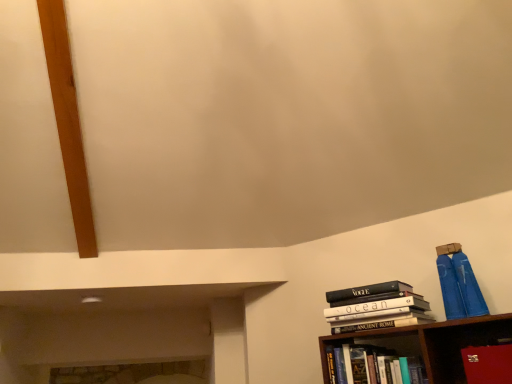
Question: From a real-world perspective, is hardcover book at lower right, which is the first book in bottom-to-top order, below hardcover books at right, placed as the second book when sorted from bottom to top?

Choices:
 (A) no
 (B) yes

Answer: (B)

Question: Can you confirm if hardcover book at lower right, which is the 2th book in top-to-bottom order, is thinner than hardcover books at right, placed as the first book when sorted from top to bottom?

Choices:
 (A) yes
 (B) no

Answer: (A)

Question: Is there a large distance between hardcover book at lower right, which is the first book in bottom-to-top order, and hardcover books at right, placed as the first book when sorted from top to bottom?

Choices:
 (A) no
 (B) yes

Answer: (A)

Question: Is hardcover book at lower right, which is the first book in bottom-to-top order, facing away from hardcover books at right, placed as the second book when sorted from bottom to top?

Choices:
 (A) yes
 (B) no

Answer: (B)

Question: Considering the relative sizes of hardcover book at lower right, which is the 2th book in top-to-bottom order, and hardcover books at right, placed as the second book when sorted from bottom to top, in the image provided, is hardcover book at lower right, which is the 2th book in top-to-bottom order, bigger than hardcover books at right, placed as the second book when sorted from bottom to top,?

Choices:
 (A) yes
 (B) no

Answer: (B)

Question: Does point (508, 349) appear closer or farther from the camera than point (425, 382)?

Choices:
 (A) farther
 (B) closer

Answer: (B)

Question: From the image's perspective, relative to hardcover book at lower right, which is the first book in bottom-to-top order, is red leather book at lower right above or below?

Choices:
 (A) below
 (B) above

Answer: (B)

Question: Considering the relative positions of red leather book at lower right and hardcover book at lower right, which is the 2th book in top-to-bottom order, in the image provided, is red leather book at lower right to the left or to the right of hardcover book at lower right, which is the 2th book in top-to-bottom order,?

Choices:
 (A) right
 (B) left

Answer: (A)

Question: In terms of size, does red leather book at lower right appear bigger or smaller than hardcover book at lower right, which is the 2th book in top-to-bottom order?

Choices:
 (A) big
 (B) small

Answer: (B)

Question: From the image's perspective, is hardcover book at lower right, which is the first book in bottom-to-top order, positioned above or below red leather book at lower right?

Choices:
 (A) above
 (B) below

Answer: (B)

Question: Would you say hardcover book at lower right, which is the 2th book in top-to-bottom order, is inside or outside red leather book at lower right?

Choices:
 (A) outside
 (B) inside

Answer: (A)

Question: Considering the positions of hardcover book at lower right, which is the 2th book in top-to-bottom order, and red leather book at lower right in the image, is hardcover book at lower right, which is the 2th book in top-to-bottom order, taller or shorter than red leather book at lower right?

Choices:
 (A) short
 (B) tall

Answer: (B)

Question: Considering the positions of hardcover book at lower right, which is the first book in bottom-to-top order, and red leather book at lower right in the image, is hardcover book at lower right, which is the first book in bottom-to-top order, wider or thinner than red leather book at lower right?

Choices:
 (A) thin
 (B) wide

Answer: (A)

Question: Is hardcover book at lower right, which is the first book in bottom-to-top order, bigger or smaller than hardcover books at right, placed as the first book when sorted from top to bottom?

Choices:
 (A) big
 (B) small

Answer: (B)

Question: From the image's perspective, relative to hardcover books at right, placed as the second book when sorted from bottom to top, is hardcover book at lower right, which is the 2th book in top-to-bottom order, above or below?

Choices:
 (A) below
 (B) above

Answer: (A)